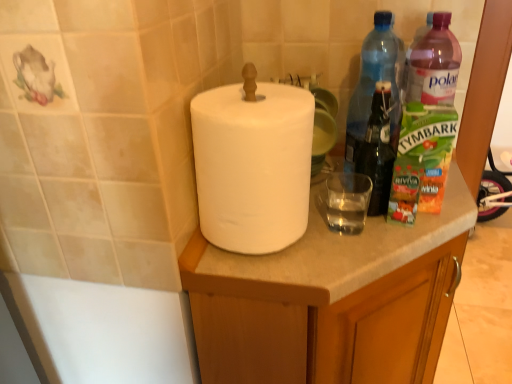
Image resolution: width=512 pixels, height=384 pixels. Identify the location of unoccupied region to the right of white matte paper towel at center. (356, 229).